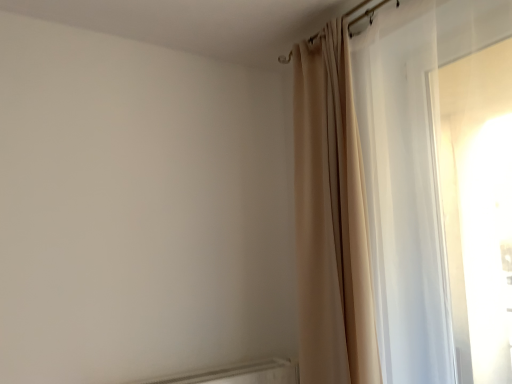
Question: Should I look upward or downward to see sheer white curtain at right, which is counted as the 1th curtain, starting from the right?

Choices:
 (A) down
 (B) up

Answer: (B)

Question: Is beige fabric curtain at upper right, the second curtain when ordered from right to left, facing towards sheer white curtain at right, which is counted as the 1th curtain, starting from the right?

Choices:
 (A) no
 (B) yes

Answer: (A)

Question: From the image's perspective, is beige fabric curtain at upper right, arranged as the 1th curtain when viewed from the left, on top of sheer white curtain at right, the 2th curtain positioned from the left?

Choices:
 (A) yes
 (B) no

Answer: (B)

Question: Can you confirm if beige fabric curtain at upper right, arranged as the 1th curtain when viewed from the left, is bigger than sheer white curtain at right, which is counted as the 1th curtain, starting from the right?

Choices:
 (A) no
 (B) yes

Answer: (A)

Question: From a real-world perspective, is beige fabric curtain at upper right, arranged as the 1th curtain when viewed from the left, physically above sheer white curtain at right, the 2th curtain positioned from the left?

Choices:
 (A) no
 (B) yes

Answer: (A)

Question: Is beige fabric curtain at upper right, arranged as the 1th curtain when viewed from the left, thinner than sheer white curtain at right, the 2th curtain positioned from the left?

Choices:
 (A) no
 (B) yes

Answer: (A)

Question: Is beige fabric curtain at upper right, the second curtain when ordered from right to left, located outside sheer white curtain at right, the 2th curtain positioned from the left?

Choices:
 (A) no
 (B) yes

Answer: (B)

Question: Considering the relative positions of sheer white curtain at right, which is counted as the 1th curtain, starting from the right, and beige fabric curtain at upper right, the second curtain when ordered from right to left, in the image provided, is sheer white curtain at right, which is counted as the 1th curtain, starting from the right, behind beige fabric curtain at upper right, the second curtain when ordered from right to left,?

Choices:
 (A) no
 (B) yes

Answer: (A)

Question: Is the depth of sheer white curtain at right, the 2th curtain positioned from the left, less than that of beige fabric curtain at upper right, the second curtain when ordered from right to left?

Choices:
 (A) yes
 (B) no

Answer: (A)

Question: Is sheer white curtain at right, which is counted as the 1th curtain, starting from the right, shorter than beige fabric curtain at upper right, the second curtain when ordered from right to left?

Choices:
 (A) yes
 (B) no

Answer: (A)

Question: Is sheer white curtain at right, which is counted as the 1th curtain, starting from the right, at the left side of beige fabric curtain at upper right, the second curtain when ordered from right to left?

Choices:
 (A) yes
 (B) no

Answer: (B)

Question: Considering the relative sizes of sheer white curtain at right, which is counted as the 1th curtain, starting from the right, and beige fabric curtain at upper right, arranged as the 1th curtain when viewed from the left, in the image provided, is sheer white curtain at right, which is counted as the 1th curtain, starting from the right, wider than beige fabric curtain at upper right, arranged as the 1th curtain when viewed from the left,?

Choices:
 (A) yes
 (B) no

Answer: (B)

Question: Is sheer white curtain at right, the 2th curtain positioned from the left, at the right side of beige fabric curtain at upper right, the second curtain when ordered from right to left?

Choices:
 (A) yes
 (B) no

Answer: (A)

Question: Is point (364, 188) closer or farther from the camera than point (320, 311)?

Choices:
 (A) farther
 (B) closer

Answer: (B)